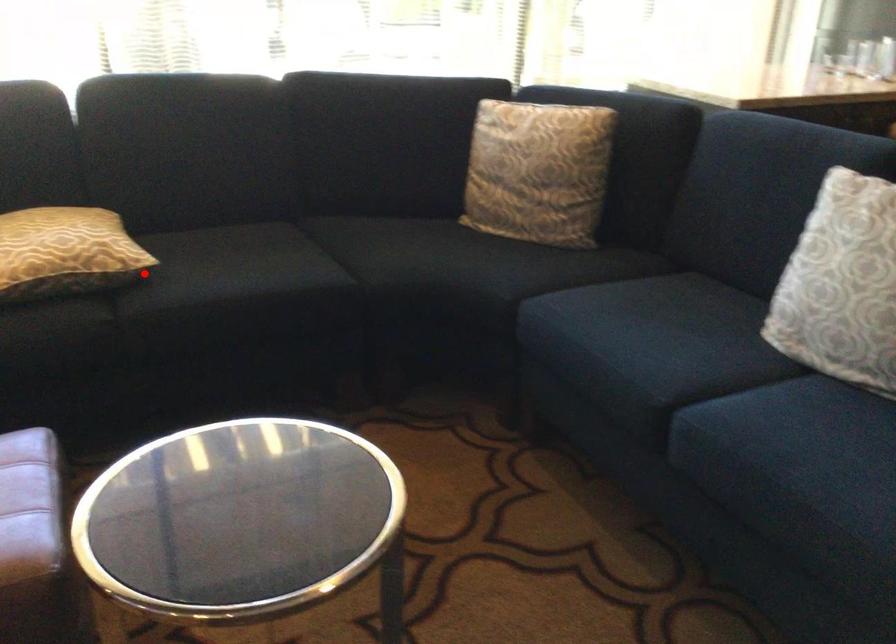
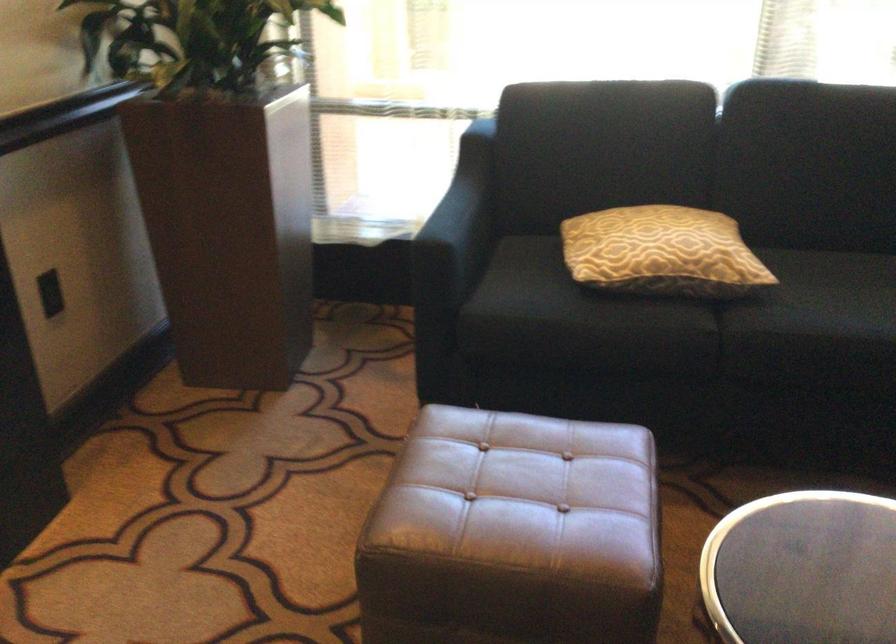
Find the pixel in the second image that matches the highlighted location in the first image.

(752, 289)